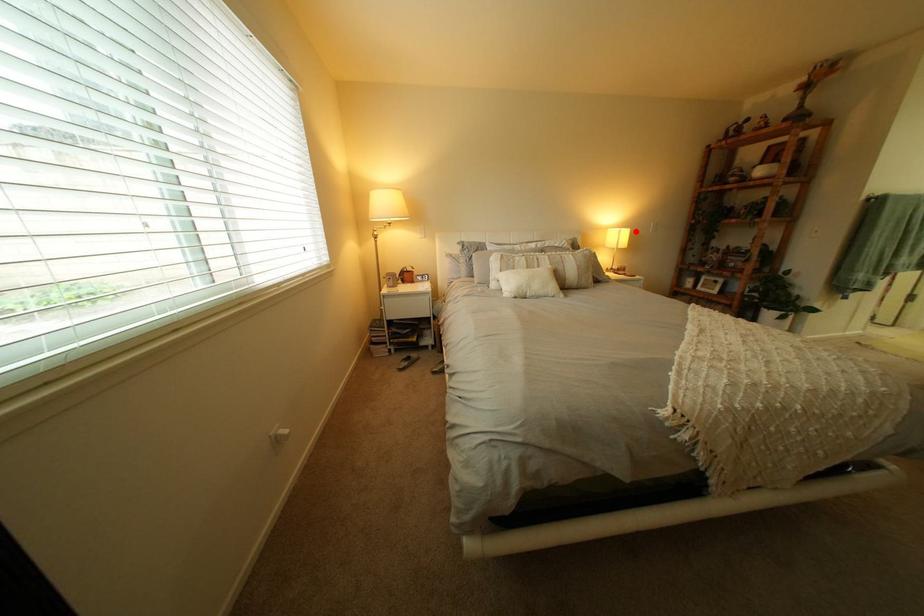
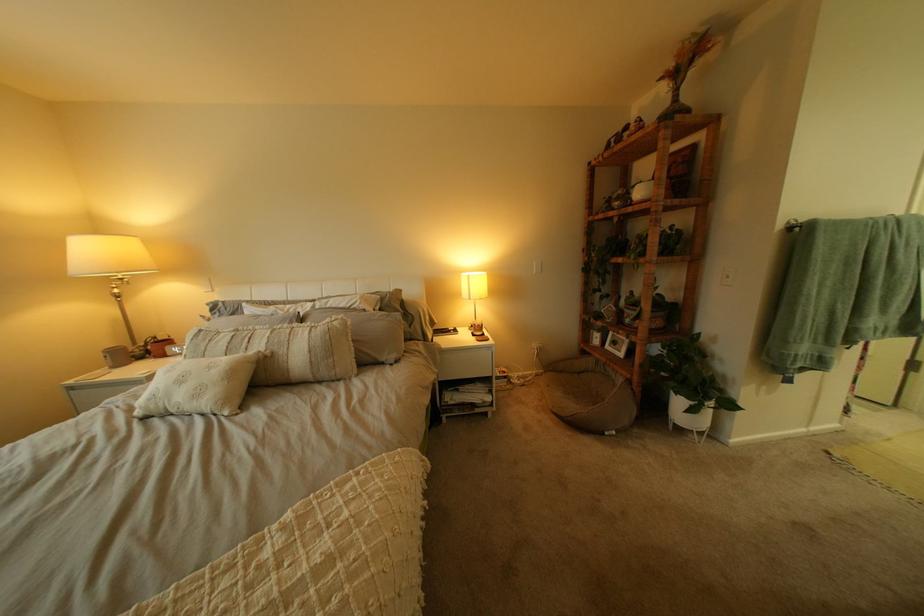
Where in the second image is the point corresponding to the highlighted location from the first image?

(483, 277)